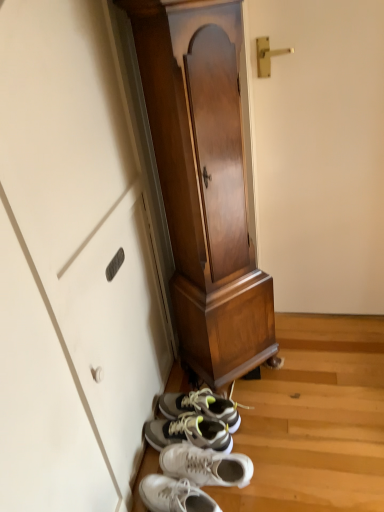
Question: From the image's perspective, is wooden cabinet at center under white leather sneakers at lower center?

Choices:
 (A) no
 (B) yes

Answer: (A)

Question: Can you confirm if wooden cabinet at center is smaller than white leather sneakers at lower center?

Choices:
 (A) no
 (B) yes

Answer: (A)

Question: Can you confirm if wooden cabinet at center is positioned to the left of white leather sneakers at lower center?

Choices:
 (A) yes
 (B) no

Answer: (B)

Question: Considering the relative sizes of wooden cabinet at center and white leather sneakers at lower center in the image provided, is wooden cabinet at center shorter than white leather sneakers at lower center?

Choices:
 (A) no
 (B) yes

Answer: (A)

Question: Considering the relative positions of wooden cabinet at center and white leather sneakers at lower center in the image provided, is wooden cabinet at center behind white leather sneakers at lower center?

Choices:
 (A) no
 (B) yes

Answer: (A)

Question: Is wooden cabinet at center in front of white leather sneakers at lower center?

Choices:
 (A) yes
 (B) no

Answer: (A)

Question: Is white leather sneakers at lower center positioned before wooden cabinet at center?

Choices:
 (A) no
 (B) yes

Answer: (A)

Question: Is white leather sneakers at lower center bigger than wooden cabinet at center?

Choices:
 (A) no
 (B) yes

Answer: (A)

Question: From a real-world perspective, is white leather sneakers at lower center positioned over wooden cabinet at center based on gravity?

Choices:
 (A) no
 (B) yes

Answer: (A)

Question: Can you confirm if white leather sneakers at lower center is thinner than wooden cabinet at center?

Choices:
 (A) no
 (B) yes

Answer: (A)

Question: Does white leather sneakers at lower center have a greater width compared to wooden cabinet at center?

Choices:
 (A) no
 (B) yes

Answer: (B)

Question: Considering the relative positions of white leather sneakers at lower center and wooden cabinet at center in the image provided, is white leather sneakers at lower center to the right of wooden cabinet at center from the viewer's perspective?

Choices:
 (A) no
 (B) yes

Answer: (A)

Question: Based on their sizes in the image, would you say wooden cabinet at center is bigger or smaller than white leather sneakers at lower center?

Choices:
 (A) small
 (B) big

Answer: (B)